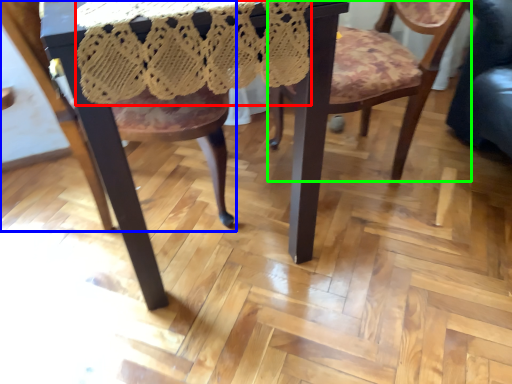
Question: Estimate the real-world distances between objects in this image. Which object is closer to lace dress (highlighted by a red box), chair (highlighted by a blue box) or chair (highlighted by a green box)?

Choices:
 (A) chair
 (B) chair

Answer: (A)